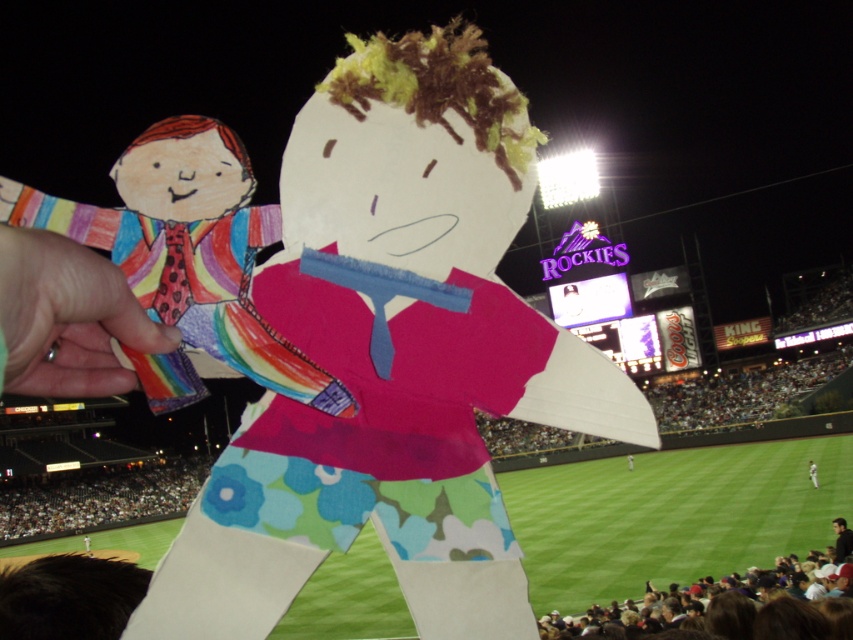
Is point (440, 61) less distant than point (815, 468)?

Yes, point (440, 61) is closer to viewer.

Does matte paper doll at center have a greater height compared to blue floral pants at center?

Yes.

Locate an element on the screen. The width and height of the screenshot is (853, 640). matte paper doll at center is located at coordinates (392, 356).